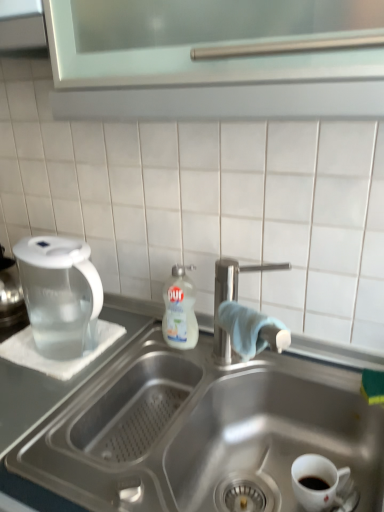
Question: Is there a large distance between stainless steel sink at center and white glossy dish soap at center?

Choices:
 (A) yes
 (B) no

Answer: (B)

Question: Can you confirm if stainless steel sink at center is wider than white glossy dish soap at center?

Choices:
 (A) yes
 (B) no

Answer: (A)

Question: Is stainless steel sink at center not within white glossy dish soap at center?

Choices:
 (A) no
 (B) yes

Answer: (B)

Question: From the image's perspective, is stainless steel sink at center above white glossy dish soap at center?

Choices:
 (A) no
 (B) yes

Answer: (A)

Question: Can you confirm if stainless steel sink at center is bigger than white glossy dish soap at center?

Choices:
 (A) no
 (B) yes

Answer: (B)

Question: Is stainless steel sink at center facing away from white glossy dish soap at center?

Choices:
 (A) yes
 (B) no

Answer: (B)

Question: Are transparent plastic pitcher at left and stainless steel sink at center far apart?

Choices:
 (A) yes
 (B) no

Answer: (B)

Question: Does transparent plastic pitcher at left have a larger size compared to stainless steel sink at center?

Choices:
 (A) yes
 (B) no

Answer: (B)

Question: Can you confirm if transparent plastic pitcher at left is taller than stainless steel sink at center?

Choices:
 (A) no
 (B) yes

Answer: (A)

Question: Is transparent plastic pitcher at left to the left of stainless steel sink at center from the viewer's perspective?

Choices:
 (A) no
 (B) yes

Answer: (A)

Question: From a real-world perspective, is transparent plastic pitcher at left physically above stainless steel sink at center?

Choices:
 (A) no
 (B) yes

Answer: (B)

Question: Does transparent plastic pitcher at left have a lesser height compared to stainless steel sink at center?

Choices:
 (A) yes
 (B) no

Answer: (A)

Question: Is transparent plastic pitcher at left located within white glossy mug at lower right?

Choices:
 (A) yes
 (B) no

Answer: (B)